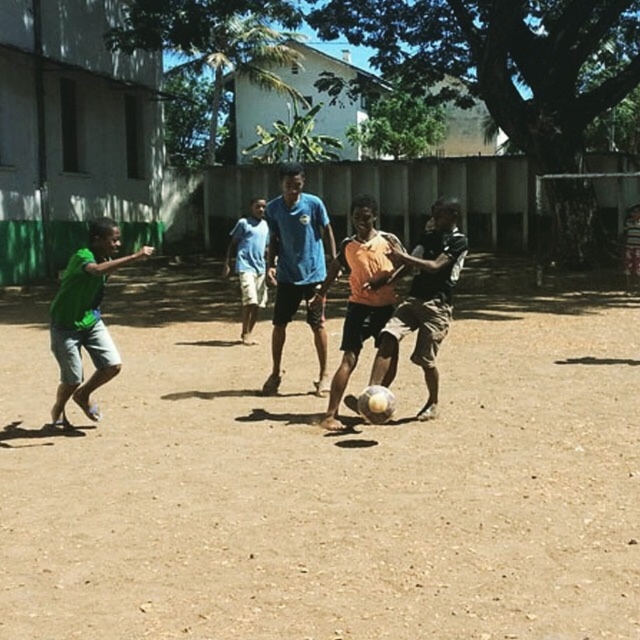
Who is taller, green matte shorts at left or blue cotton shirt at center?

blue cotton shirt at center

Can you confirm if green matte shorts at left is shorter than blue cotton shirt at center?

Indeed, green matte shorts at left has a lesser height compared to blue cotton shirt at center.

I want to click on green matte shorts at left, so click(x=84, y=317).

Can you confirm if brown sandy soil at center is wider than orange matte shirt at center?

Yes, brown sandy soil at center is wider than orange matte shirt at center.

Based on the photo, which is more to the left, brown sandy soil at center or orange matte shirt at center?

brown sandy soil at center

Does point (26, 520) lie in front of point (365, 204)?

That is True.

Find the location of a particular element. The image size is (640, 640). brown sandy soil at center is located at coordinates [x=323, y=481].

Does green matte shorts at left appear under blue fabric shirt at center?

No, green matte shorts at left is not below blue fabric shirt at center.

Does green matte shorts at left have a greater width compared to blue fabric shirt at center?

Correct, the width of green matte shorts at left exceeds that of blue fabric shirt at center.

Is point (83, 310) positioned after point (269, 268)?

No, (83, 310) is in front of (269, 268).

The height and width of the screenshot is (640, 640). I want to click on green matte shorts at left, so 84,317.